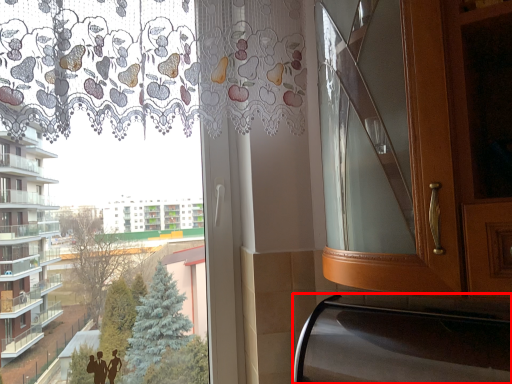
Question: From the image's perspective, where is oven (annotated by the red box) located relative to bay window?

Choices:
 (A) above
 (B) below

Answer: (B)